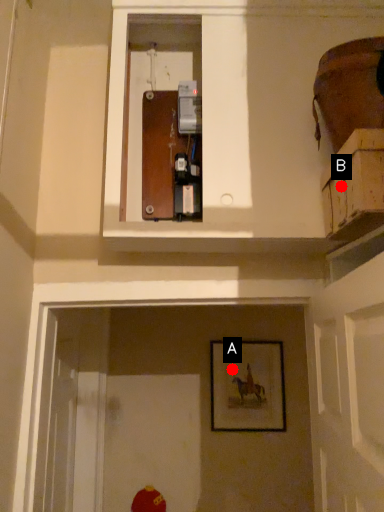
Question: Two points are circled on the image, labeled by A and B beside each circle. Which of the following is the closest to the observer?

Choices:
 (A) A is closer
 (B) B is closer

Answer: (B)